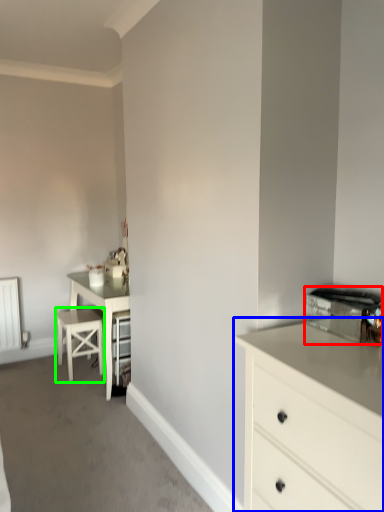
Question: Which object is positioned closest to appliance (highlighted by a red box)? Select from chest of drawers (highlighted by a blue box) and bar stool (highlighted by a green box).

Choices:
 (A) chest of drawers
 (B) bar stool

Answer: (A)